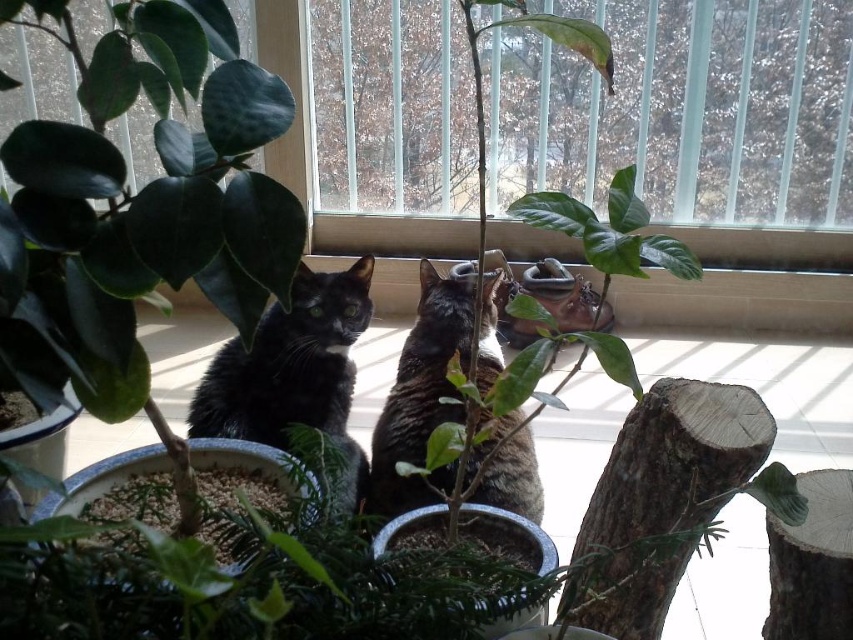
Question: Does black glossy cat at center appear on the right side of black fur cat at center?

Choices:
 (A) yes
 (B) no

Answer: (B)

Question: Which point is farther to the camera?

Choices:
 (A) transparent plastic window at center
 (B) black fur cat at center

Answer: (A)

Question: Can you confirm if transparent plastic window at center is positioned above black fur cat at center?

Choices:
 (A) no
 (B) yes

Answer: (B)

Question: Is black glossy cat at center to the right of black fur cat at center from the viewer's perspective?

Choices:
 (A) yes
 (B) no

Answer: (B)

Question: Estimate the real-world distances between objects in this image. Which object is closer to the transparent plastic window at center?

Choices:
 (A) black glossy cat at center
 (B) black fur cat at center

Answer: (B)

Question: Considering the real-world distances, which object is farthest from the black fur cat at center?

Choices:
 (A) transparent plastic window at center
 (B) black glossy cat at center

Answer: (A)